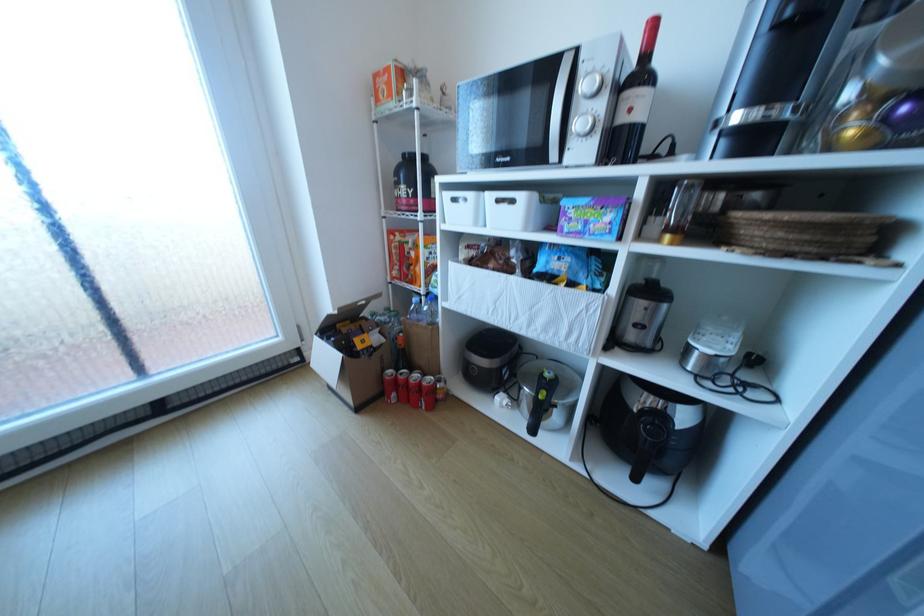
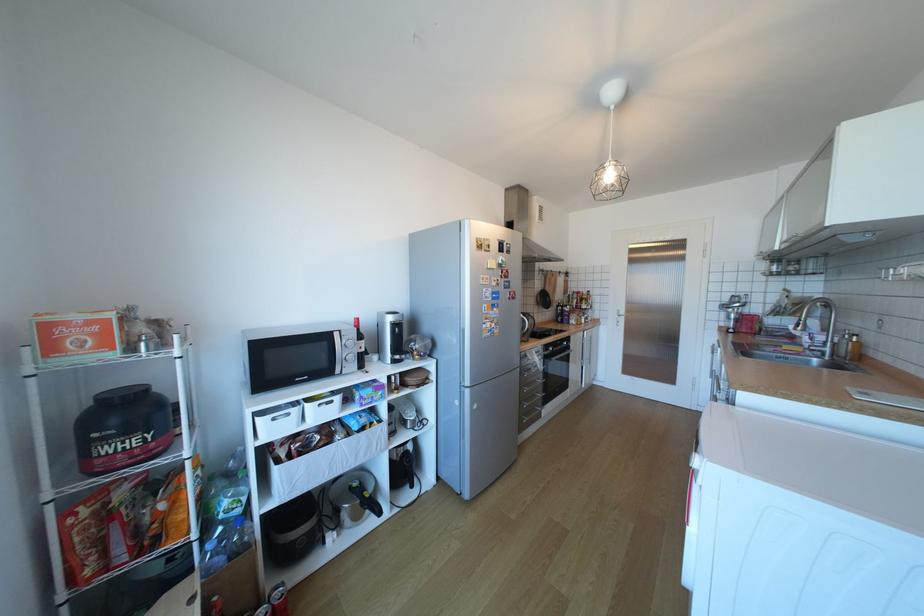
Where in the second image is the point corresponding to the point at 521,201 from the first image?

(341, 402)